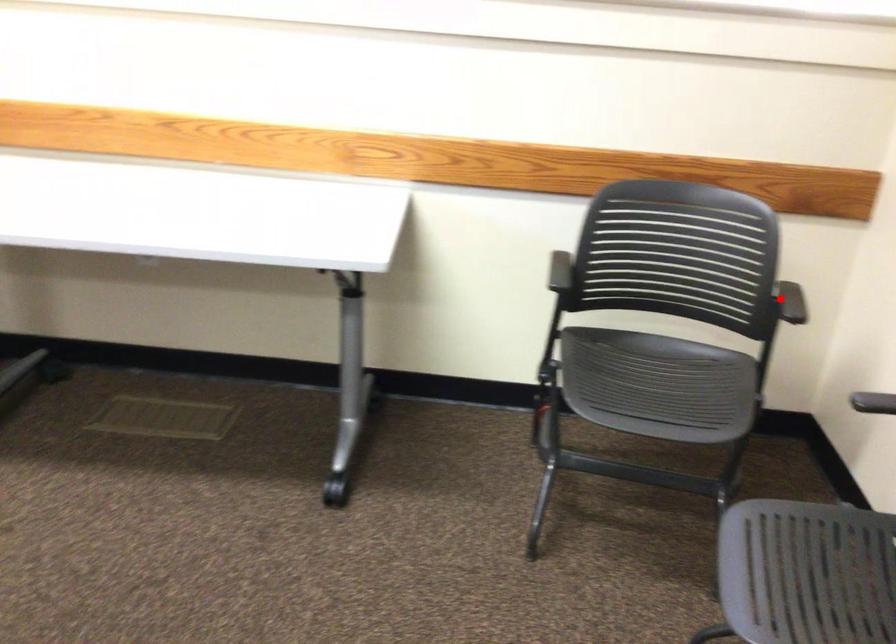
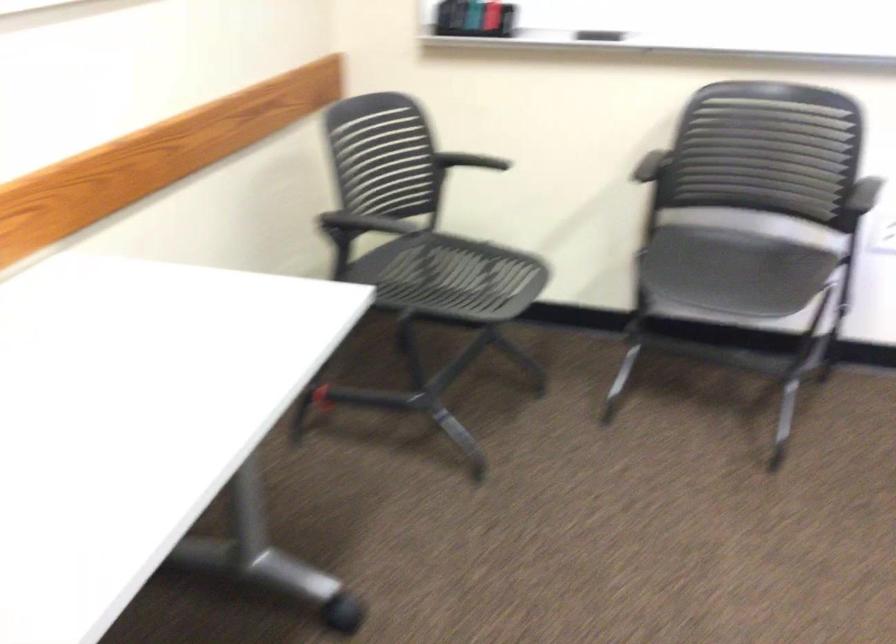
Find the pixel in the second image that matches the highlighted location in the first image.

(470, 161)